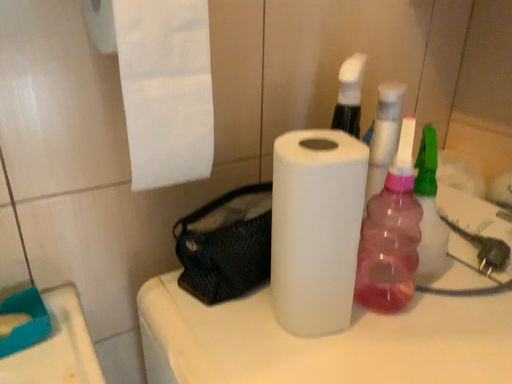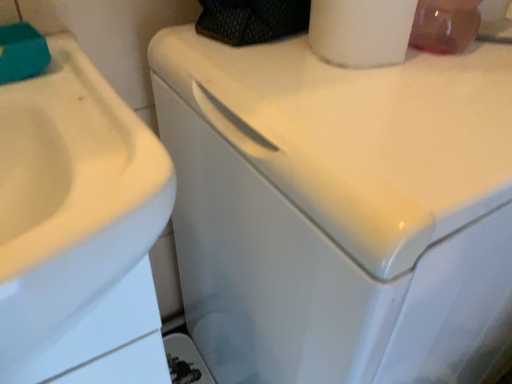
Question: How did the camera likely rotate when shooting the video?

Choices:
 (A) rotated downward
 (B) rotated upward

Answer: (A)